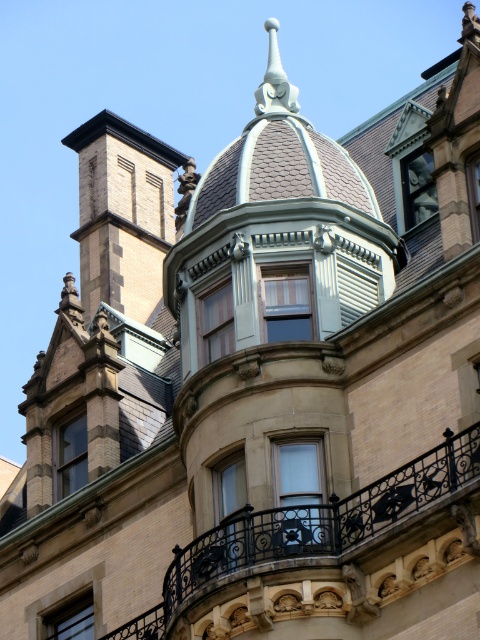
Question: Does wooden frame window at center have a lesser width compared to clear glass window at upper center?

Choices:
 (A) yes
 (B) no

Answer: (B)

Question: Considering the relative positions of clear glass window at center and clear glass window at upper center in the image provided, where is clear glass window at center located with respect to clear glass window at upper center?

Choices:
 (A) right
 (B) left

Answer: (B)

Question: Does clear glass window at center have a smaller size compared to clear glass window at lower left?

Choices:
 (A) no
 (B) yes

Answer: (A)

Question: Which point is closer to the camera?

Choices:
 (A) clear glass window at center
 (B) wooden frame window at center

Answer: (A)

Question: Which of these objects is positioned closest to the clear glass window at center?

Choices:
 (A) white glass window at center
 (B) polished wrought iron balcony at center

Answer: (A)

Question: Among these objects, which one is nearest to the camera?

Choices:
 (A) polished wrought iron balcony at center
 (B) clear glass window at upper center

Answer: (A)